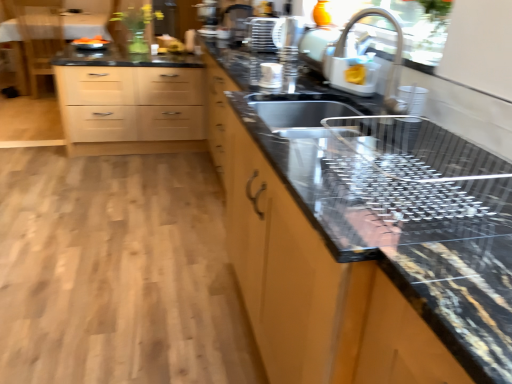
Question: From the image's perspective, does white plastic dishwashing machine at upper center, the second appliance when ordered from left to right, appear higher than wooden chair at upper left?

Choices:
 (A) no
 (B) yes

Answer: (A)

Question: From a real-world perspective, is white plastic dishwashing machine at upper center, the second appliance when ordered from left to right, below wooden chair at upper left?

Choices:
 (A) no
 (B) yes

Answer: (A)

Question: Can you confirm if white plastic dishwashing machine at upper center, the second appliance viewed from the top, is smaller than wooden chair at upper left?

Choices:
 (A) no
 (B) yes

Answer: (B)

Question: Is white plastic dishwashing machine at upper center, the second appliance viewed from the top, in front of wooden chair at upper left?

Choices:
 (A) yes
 (B) no

Answer: (A)

Question: Can you confirm if white plastic dishwashing machine at upper center, which is the second appliance from back to front, is shorter than wooden chair at upper left?

Choices:
 (A) no
 (B) yes

Answer: (B)

Question: Is wooden chair at upper left a part of white plastic dishwashing machine at upper center, which is the second appliance from back to front?

Choices:
 (A) yes
 (B) no

Answer: (B)

Question: Is metallic sink at center at the back of black granite countertop at center?

Choices:
 (A) no
 (B) yes

Answer: (A)

Question: Considering the relative positions of black granite countertop at center and metallic sink at center in the image provided, is black granite countertop at center behind metallic sink at center?

Choices:
 (A) yes
 (B) no

Answer: (B)

Question: Is black granite countertop at center shorter than metallic sink at center?

Choices:
 (A) no
 (B) yes

Answer: (A)

Question: From a real-world perspective, is black granite countertop at center over metallic sink at center?

Choices:
 (A) no
 (B) yes

Answer: (A)

Question: Does black granite countertop at center have a greater width compared to metallic sink at center?

Choices:
 (A) yes
 (B) no

Answer: (A)

Question: Is black granite countertop at center far from metallic sink at center?

Choices:
 (A) no
 (B) yes

Answer: (A)

Question: Does wooden chair at upper left have a smaller size compared to metallic sink at center?

Choices:
 (A) yes
 (B) no

Answer: (B)